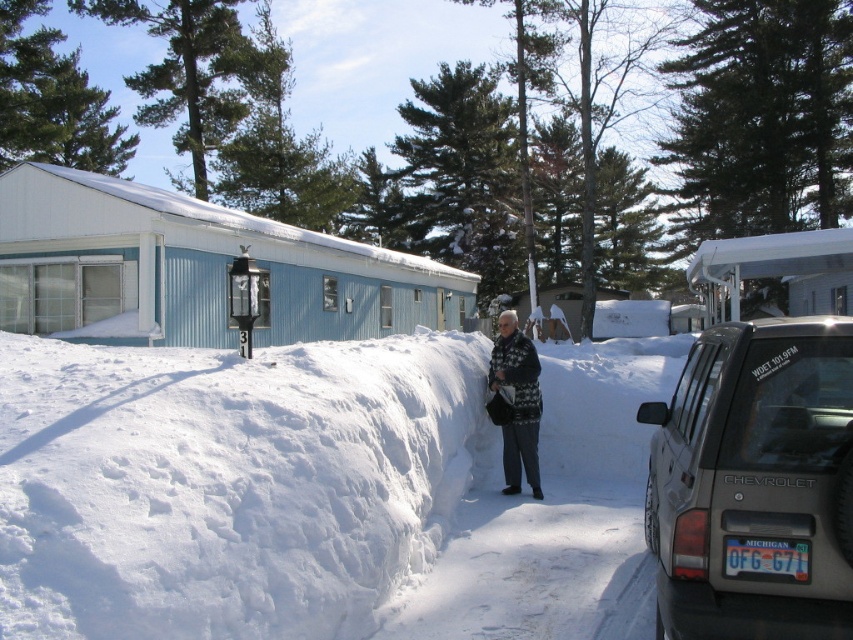
Question: From the image, what is the correct spatial relationship of white knitted sweater at center in relation to wooden cabin at center?

Choices:
 (A) left
 (B) right

Answer: (A)

Question: Which object is closer to the camera taking this photo?

Choices:
 (A) metallic gray suv at right
 (B) white fluffy snow at center

Answer: (A)

Question: Which of the following is the farthest from the observer?

Choices:
 (A) white plastic awning at upper right
 (B) white fluffy snow at center
 (C) white knitted sweater at center

Answer: (A)

Question: Is metallic gray suv at right positioned behind wooden cabin at center?

Choices:
 (A) yes
 (B) no

Answer: (B)

Question: Which point is closer to the camera?

Choices:
 (A) white knitted sweater at center
 (B) metallic gray suv at right
 (C) white fluffy snow at center
 (D) white plastic awning at upper right

Answer: (B)

Question: Does white knitted sweater at center have a smaller size compared to wooden cabin at center?

Choices:
 (A) yes
 (B) no

Answer: (A)